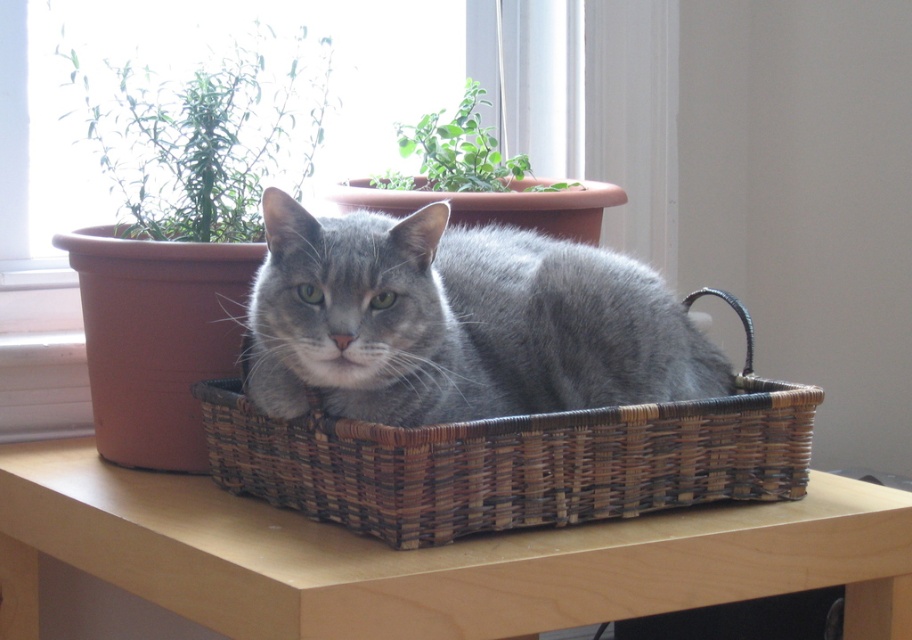
Based on the photo, you are a photographer setting up a shoot in this room. You have a camera that can focus on objects up to 1 meter tall. The gray matte fur cat at center and the green leafy plant at upper left are both in your frame. Which object will require you to adjust your camera settings to accommodate its height?

The green leafy plant at upper left will require adjusting the camera settings because it is taller than the gray matte fur cat at center, which is within the 1 meter focus range.

You are a photographer setting up a shoot in this scene. You want to ensure that the gray matte fur cat at center is clearly visible without the green leafy plant at upper left blocking it. Based on their positions, will you need to adjust the camera angle to achieve this?

The gray matte fur cat at center is in front of the green leafy plant at upper left, so no adjustment is needed. The cat naturally blocks the plant, making it visible without obstruction.